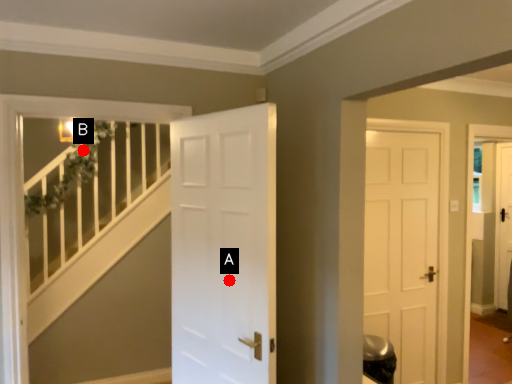
Question: Two points are circled on the image, labeled by A and B beside each circle. Which point is closer to the camera taking this photo?

Choices:
 (A) A is closer
 (B) B is closer

Answer: (A)